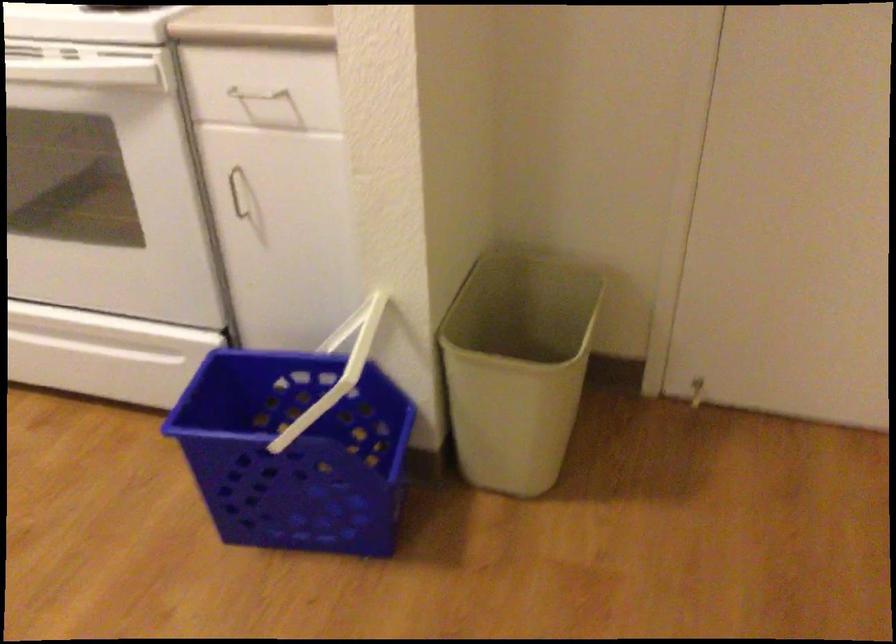
I want to click on drawer handle, so click(x=253, y=98).